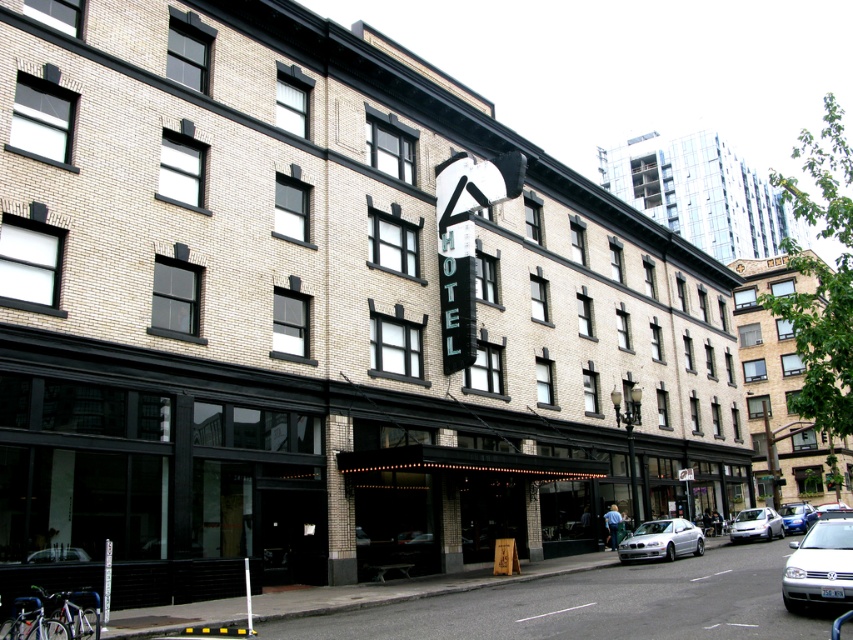
You are standing at the entrance of the building and want to park your car which is 15 feet long. The white matte sedan at lower right is parked nearby. Can you safely park your car in the available space behind it without hitting the sedan?

The white matte sedan at lower right is 58.60 feet away from the camera. Since your car is only 15 feet long, there is sufficient space to park behind it without any collision.

You are a delivery person standing in front of the building and need to park your van which is 7 meters long. There are two cars parked at the lower right of the building. Can you fit your van between the white matte sedan at lower right and the silver metallic car at lower right?

The distance between the white matte sedan at lower right and the silver metallic car at lower right is 20.63 meters. Since your van is only 7 meters long, there is enough space to park it between them.